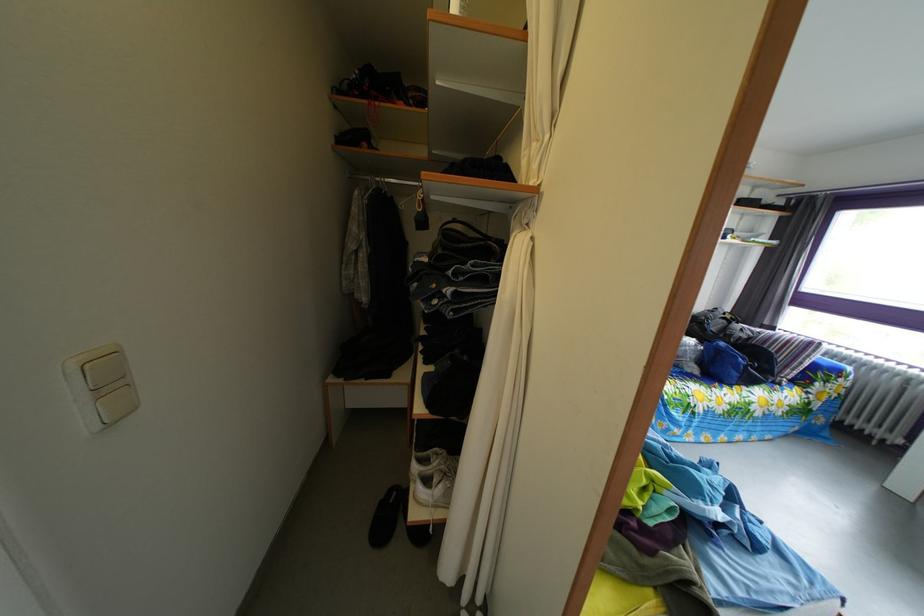
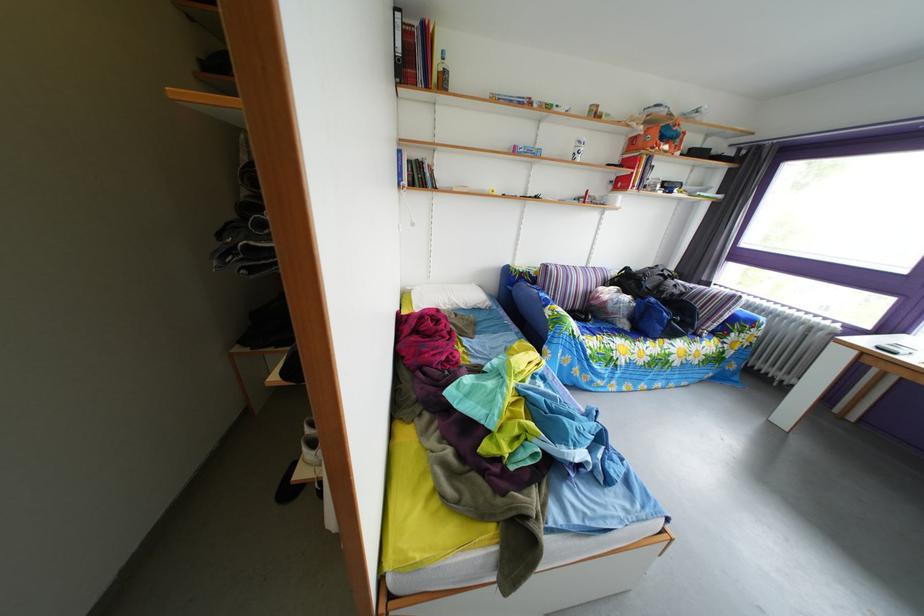
Question: The images are taken continuously from a first-person perspective. In which direction is your viewpoint rotating?

Choices:
 (A) Left
 (B) Right
 (C) Up
 (D) Down

Answer: (D)